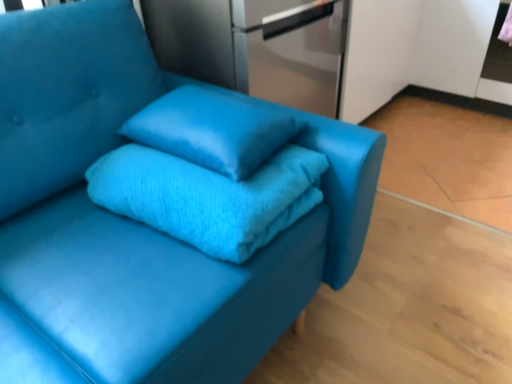
Question: Is turquoise fuzzy bath towel at center smaller than satin silver refrigerator at upper center?

Choices:
 (A) yes
 (B) no

Answer: (A)

Question: Is turquoise fuzzy bath towel at center further to the viewer compared to satin silver refrigerator at upper center?

Choices:
 (A) yes
 (B) no

Answer: (B)

Question: From the image's perspective, is turquoise fuzzy bath towel at center over satin silver refrigerator at upper center?

Choices:
 (A) no
 (B) yes

Answer: (A)

Question: From a real-world perspective, is turquoise fuzzy bath towel at center on satin silver refrigerator at upper center?

Choices:
 (A) yes
 (B) no

Answer: (B)

Question: From the image's perspective, does turquoise fuzzy bath towel at center appear lower than satin silver refrigerator at upper center?

Choices:
 (A) no
 (B) yes

Answer: (B)

Question: Is turquoise fuzzy bath towel at center wider than satin silver refrigerator at upper center?

Choices:
 (A) yes
 (B) no

Answer: (B)

Question: Is matte blue pillow at center thinner than satin silver refrigerator at upper center?

Choices:
 (A) yes
 (B) no

Answer: (A)

Question: Can you confirm if matte blue pillow at center is bigger than satin silver refrigerator at upper center?

Choices:
 (A) yes
 (B) no

Answer: (B)

Question: Is matte blue pillow at center located outside satin silver refrigerator at upper center?

Choices:
 (A) yes
 (B) no

Answer: (A)

Question: From the image's perspective, is matte blue pillow at center beneath satin silver refrigerator at upper center?

Choices:
 (A) yes
 (B) no

Answer: (A)

Question: From a real-world perspective, is matte blue pillow at center located higher than satin silver refrigerator at upper center?

Choices:
 (A) yes
 (B) no

Answer: (A)

Question: Is matte blue pillow at center oriented away from satin silver refrigerator at upper center?

Choices:
 (A) yes
 (B) no

Answer: (B)

Question: From a real-world perspective, does matte blue pillow at center sit lower than turquoise fuzzy bath towel at center?

Choices:
 (A) no
 (B) yes

Answer: (A)